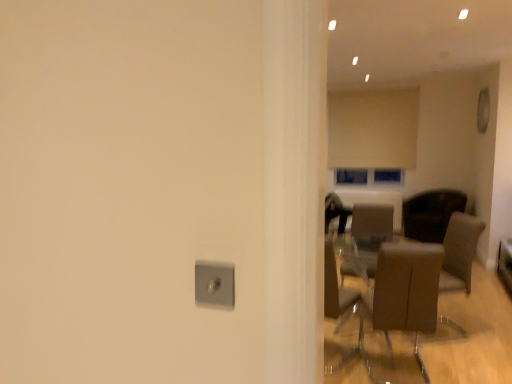
Question: Considering the positions of beige fabric curtain at upper center and satin silver outlet at center in the image, is beige fabric curtain at upper center taller or shorter than satin silver outlet at center?

Choices:
 (A) tall
 (B) short

Answer: (A)

Question: Is beige fabric curtain at upper center inside or outside of satin silver outlet at center?

Choices:
 (A) outside
 (B) inside

Answer: (A)

Question: Based on their relative distances, which object is nearer to the brown fabric armchair at right?

Choices:
 (A) white textured radiator at center
 (B) satin silver outlet at center
 (C) beige fabric curtain at upper center
 (D) brown leather chair at center, placed as the 2th chair when sorted from right to left
 (E) clear glass window at center

Answer: (D)

Question: Estimate the real-world distances between objects in this image. Which object is farther from the brown leather chair at center, placed as the 2th chair when sorted from right to left?

Choices:
 (A) brown leather chair at center-right, the third chair from the front
 (B) brown fabric armchair at right
 (C) clear glass window at center
 (D) satin silver outlet at center
 (E) beige fabric curtain at upper center

Answer: (D)